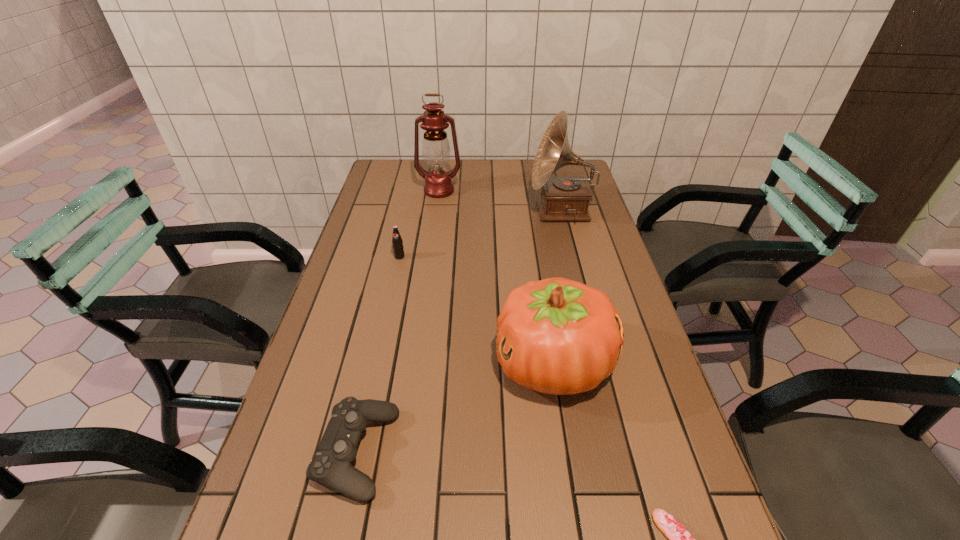
Locate an element on the screen. The height and width of the screenshot is (540, 960). vacant region between the third farthest object and the oil lamp is located at coordinates (420, 224).

The height and width of the screenshot is (540, 960). I want to click on vacant point located between the control and the oil lamp, so click(x=398, y=322).

Locate an element on the screen. free area in between the oil lamp and the third farthest object is located at coordinates (420, 224).

Where is `vacant area that lies between the pumpkin and the control`? vacant area that lies between the pumpkin and the control is located at coordinates (455, 409).

This screenshot has width=960, height=540. I want to click on the fourth closest object relative to the third farthest object, so click(x=331, y=466).

Select which object is the second closest to the phonograph record. Please provide its 2D coordinates. Your answer should be formatted as a tuple, i.e. [(x, y)], where the tuple contains the x and y coordinates of a point satisfying the conditions above.

[(557, 336)]

Find the location of `free spot that satisfies the following two spatial constraints: 1. on the horn of the phonograph record; 2. on the front label of the pop`. free spot that satisfies the following two spatial constraints: 1. on the horn of the phonograph record; 2. on the front label of the pop is located at coordinates (573, 256).

Find the location of a particular element. vacant area that satisfies the following two spatial constraints: 1. on the side of the pumpkin with the cute face; 2. on the front side of the control is located at coordinates (567, 454).

Find the location of a particular element. blank area in the image that satisfies the following two spatial constraints: 1. on the horn of the phonograph record; 2. on the front label of the fourth tallest object is located at coordinates (573, 256).